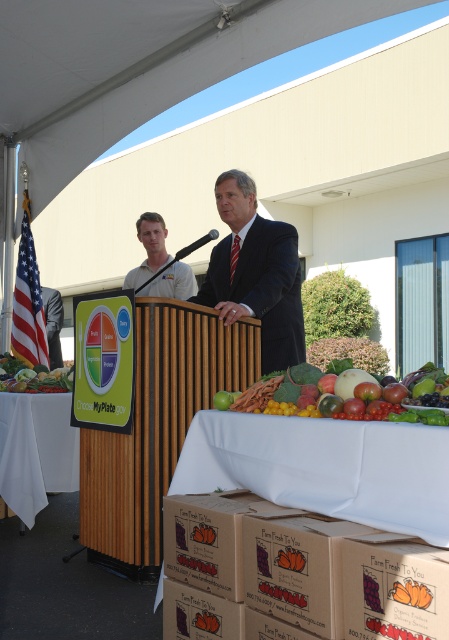
Consider the image. You are attending a nutrition seminar and notice the brown cardboard box at lower center and the white cotton shirt at center. Which object is positioned lower in the scene?

The brown cardboard box at lower center is located below the white cotton shirt at center, so it is positioned lower in the scene.